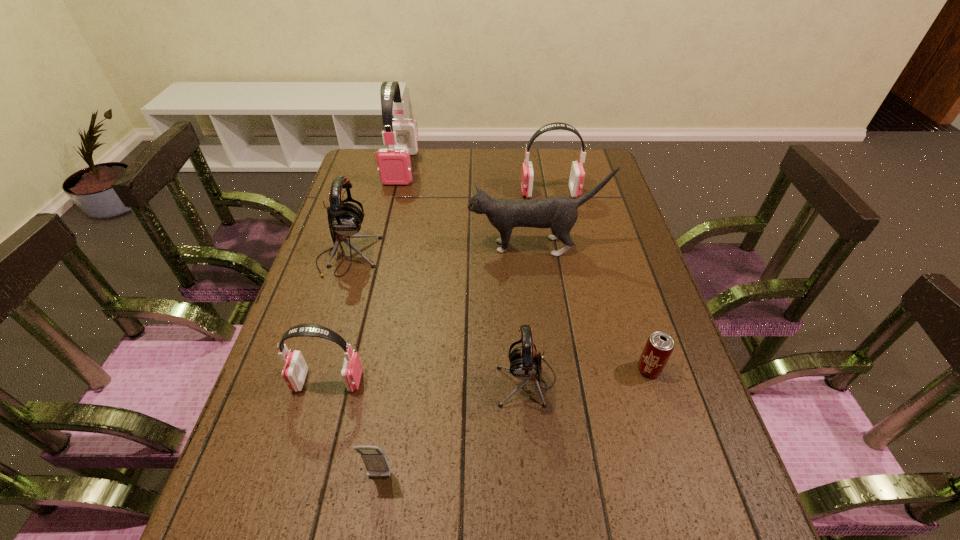
Where is `the tallest earphone`? Image resolution: width=960 pixels, height=540 pixels. the tallest earphone is located at coordinates (394, 165).

The image size is (960, 540). I want to click on cat, so click(559, 213).

Image resolution: width=960 pixels, height=540 pixels. Identify the location of the left black earphone. (345, 219).

At what (x,y) coordinates should I click in order to perform the action: click on the third farthest earphone. Please return your answer as a coordinate pair (x, y). Looking at the image, I should click on (345, 219).

In order to click on the second smallest pink earphone in this screenshot , I will do `click(577, 174)`.

The width and height of the screenshot is (960, 540). I want to click on the nearer black earphone, so click(525, 363).

Identify the location of the right black earphone. (525, 363).

Identify the location of the nearest pink earphone. The height and width of the screenshot is (540, 960). (295, 369).

Image resolution: width=960 pixels, height=540 pixels. Identify the location of the fourth object from left to right. (375, 461).

This screenshot has width=960, height=540. Identify the location of gray cellular telephone. (375, 461).